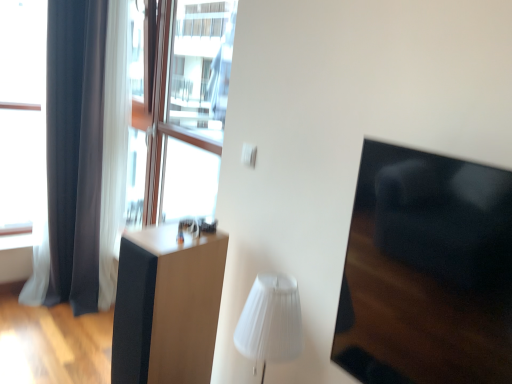
The width and height of the screenshot is (512, 384). What are the coordinates of `vacant space situated above matte black speaker at center (from a real-world perspective)` in the screenshot? It's located at (178, 230).